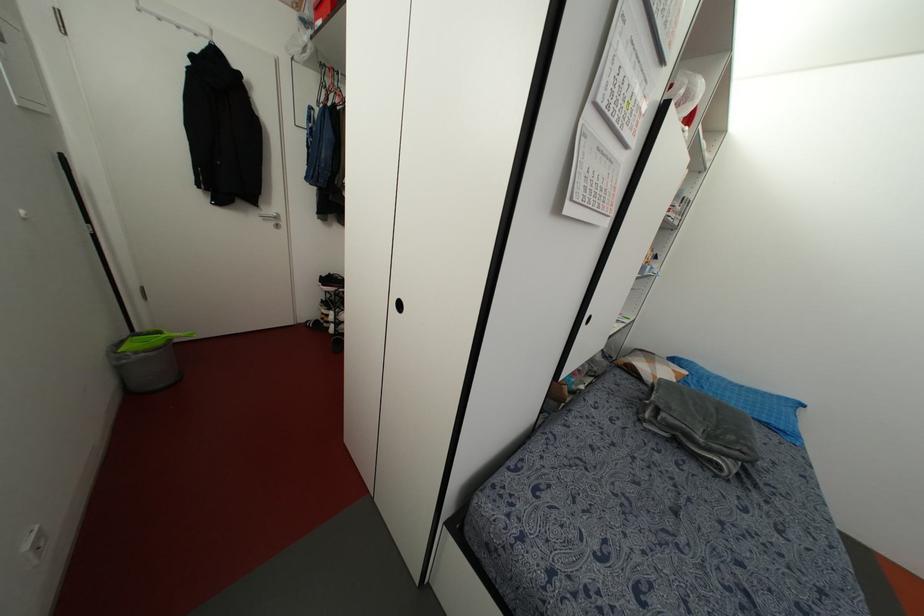
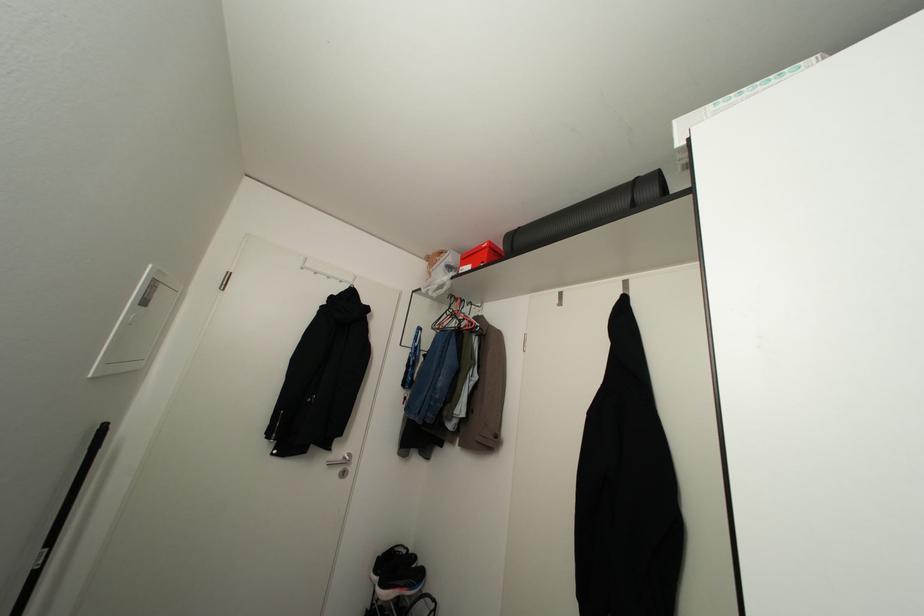
Where in the second image is the point corresponding to [276,225] from the first image?

(343, 472)